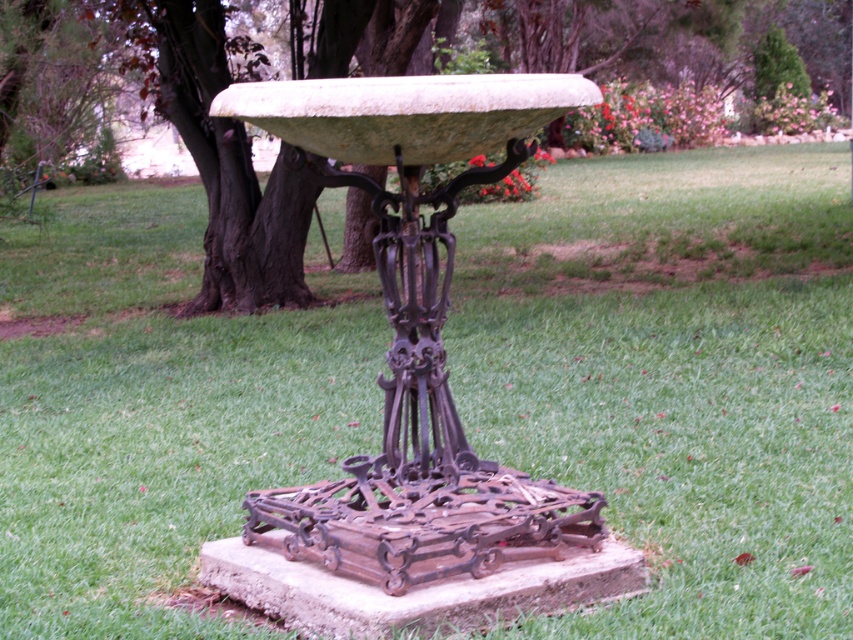
You are standing in the garden and see both the green stone bowl at center and the green matte stone bowl at center. Which one is positioned to the left?

The green stone bowl at center is positioned to the left of the green matte stone bowl at center.

You are standing in front of the birdbath and want to place a small decoration. You have two points to choose from on the birdbath structure. Which point is closer to you, point (x=399, y=195) or point (x=306, y=220)?

Point (x=399, y=195) is closer to the viewer than point (x=306, y=220), so you should place the decoration there if you want it nearer to your position.